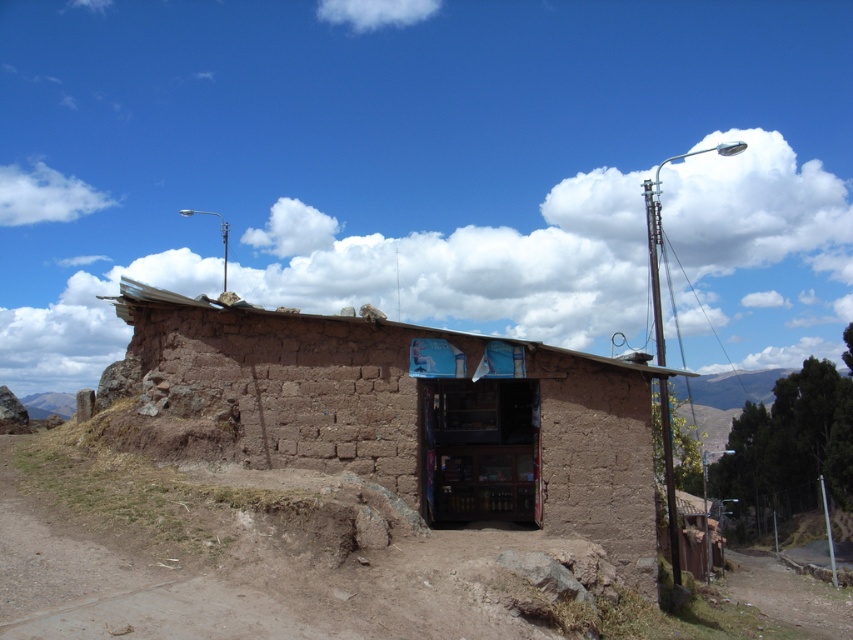
Question: Is brown dirt track at center bigger than metallic pole at right?

Choices:
 (A) yes
 (B) no

Answer: (B)

Question: Based on their relative distances, which object is nearer to the brown mud hut at center?

Choices:
 (A) metallic pole at right
 (B) brown dirt track at center

Answer: (B)

Question: From the image, what is the correct spatial relationship of brown mud hut at center in relation to metallic pole at right?

Choices:
 (A) below
 (B) above

Answer: (A)

Question: Which object is positioned closest to the brown dirt track at center?

Choices:
 (A) brown mud hut at center
 (B) metallic pole at right

Answer: (A)

Question: Can you confirm if brown mud hut at center is bigger than metallic pole at right?

Choices:
 (A) yes
 (B) no

Answer: (B)

Question: Among these objects, which one is farthest from the camera?

Choices:
 (A) brown dirt track at center
 (B) metallic pole at right
 (C) brown mud hut at center

Answer: (B)